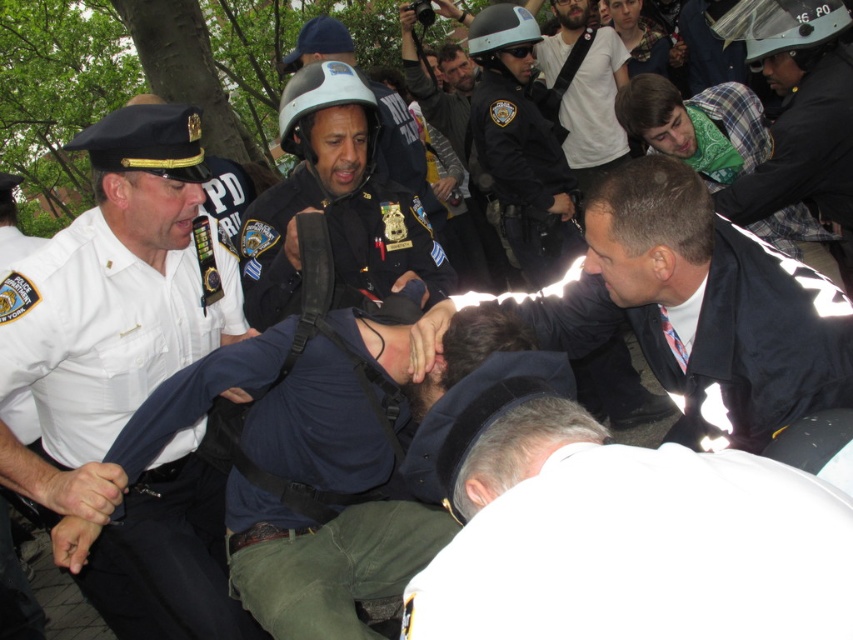
Looking at this image, based on the scene described, which object is bigger between the white uniform shirt at left and the matte black helmet at center?

The white uniform shirt at left is larger in size than the matte black helmet at center.

You are a photographer positioned at the edge of the scene. You need to capture a clear photo of both the white matte shirt at lower center and the matte black helmet at center. Which object will appear larger in your photo?

The white matte shirt at lower center will appear larger in the photo because it is closer to the viewer than the matte black helmet at center.

You are a journalist documenting the scene. You need to describe the positions of the white uniform shirt at left and the matte black helmet at center in relation to each other. Which one is located to the left?

The white uniform shirt at left is positioned on the left side of the matte black helmet at center, so the white uniform shirt at left is more to the left.